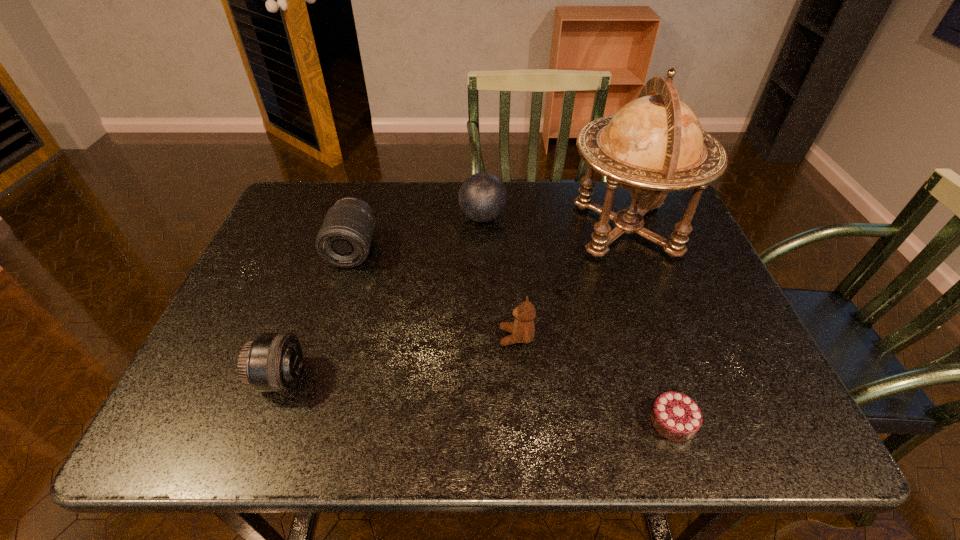
The height and width of the screenshot is (540, 960). In order to click on free point that satisfies the following two spatial constraints: 1. on the front-facing side of the globe; 2. on the surface of the farther telephoto lens in this screenshot , I will do `click(634, 249)`.

Where is `free space that satisfies the following two spatial constraints: 1. on the front-facing side of the tallest object; 2. on the surface of the farther telephoto lens`? Image resolution: width=960 pixels, height=540 pixels. free space that satisfies the following two spatial constraints: 1. on the front-facing side of the tallest object; 2. on the surface of the farther telephoto lens is located at coordinates (634, 249).

Find the location of a particular element. This screenshot has height=540, width=960. vacant area in the image that satisfies the following two spatial constraints: 1. on the front-facing side of the tallest object; 2. on the surface of the farther telephoto lens is located at coordinates (634, 249).

The width and height of the screenshot is (960, 540). In order to click on vacant space that satisfies the following two spatial constraints: 1. on the back side of the shortest object; 2. at the face of the third nearest object in this screenshot , I will do `click(645, 337)`.